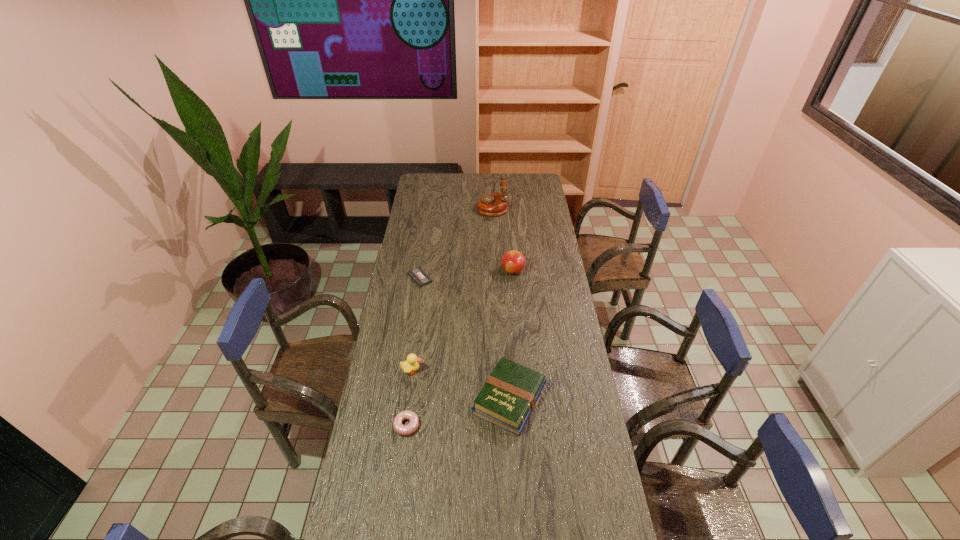
Image resolution: width=960 pixels, height=540 pixels. What are the coordinates of `blank space located on the front of the apple` in the screenshot? It's located at (516, 313).

Locate an element on the screen. Image resolution: width=960 pixels, height=540 pixels. vacant space located 0.230m on the front-facing side of the duckling is located at coordinates point(483,371).

Where is `vacant space located 0.050m on the front of the fourth tallest object`? This screenshot has width=960, height=540. vacant space located 0.050m on the front of the fourth tallest object is located at coordinates (513, 451).

The width and height of the screenshot is (960, 540). Identify the location of free spot located 0.310m on the front of the doughnut. (391, 539).

The height and width of the screenshot is (540, 960). I want to click on vacant region located 0.310m on the front of the videotape, so click(411, 340).

Find the location of a particular element. Image resolution: width=960 pixels, height=540 pixels. duckling present at the left edge is located at coordinates (409, 365).

The width and height of the screenshot is (960, 540). Identify the location of doughnut present at the left edge. (408, 429).

This screenshot has width=960, height=540. Identify the location of videotape that is at the left edge. (418, 275).

Where is `object located in the right edge section of the desktop`? The height and width of the screenshot is (540, 960). object located in the right edge section of the desktop is located at coordinates (509, 395).

This screenshot has width=960, height=540. In the image, there is a desktop. Identify the location of vacant area at the far edge. (492, 188).